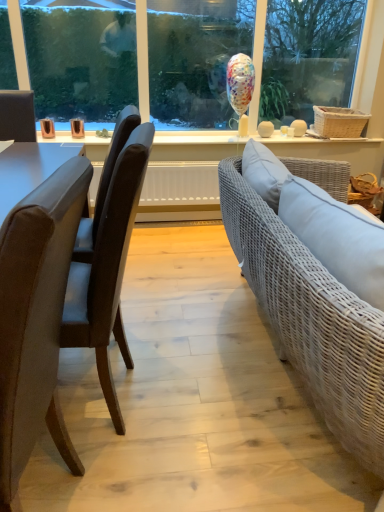
Question: Is brown leather chair at left, which is the 1th chair from front to back, further to camera compared to leather chair at left, the 1th chair from the back?

Choices:
 (A) no
 (B) yes

Answer: (A)

Question: From a real-world perspective, is brown leather chair at left, which is the 1th chair from front to back, over leather chair at left, the second chair from the front?

Choices:
 (A) yes
 (B) no

Answer: (A)

Question: Does brown leather chair at left, positioned as the 2th chair in back-to-front order, have a lesser width compared to leather chair at left, the 1th chair from the back?

Choices:
 (A) yes
 (B) no

Answer: (A)

Question: From the image's perspective, is brown leather chair at left, positioned as the 2th chair in back-to-front order, located beneath leather chair at left, the 1th chair from the back?

Choices:
 (A) yes
 (B) no

Answer: (A)

Question: Does brown leather chair at left, positioned as the 2th chair in back-to-front order, have a greater width compared to leather chair at left, the 1th chair from the back?

Choices:
 (A) no
 (B) yes

Answer: (A)

Question: Does brown leather chair at left, positioned as the 2th chair in back-to-front order, contain leather chair at left, the 1th chair from the back?

Choices:
 (A) no
 (B) yes

Answer: (A)

Question: Is leather chair at left, the 1th chair from the back, closer to the viewer compared to brown leather chair at left, positioned as the 2th chair in back-to-front order?

Choices:
 (A) no
 (B) yes

Answer: (A)

Question: From a real-world perspective, is leather chair at left, the 1th chair from the back, physically above brown leather chair at left, positioned as the 2th chair in back-to-front order?

Choices:
 (A) yes
 (B) no

Answer: (B)

Question: From the image's perspective, is leather chair at left, the second chair from the front, on brown leather chair at left, positioned as the 2th chair in back-to-front order?

Choices:
 (A) no
 (B) yes

Answer: (B)

Question: Considering the relative sizes of leather chair at left, the second chair from the front, and brown leather chair at left, which is the 1th chair from front to back, in the image provided, is leather chair at left, the second chair from the front, bigger than brown leather chair at left, which is the 1th chair from front to back,?

Choices:
 (A) no
 (B) yes

Answer: (B)

Question: Does leather chair at left, the 1th chair from the back, contain brown leather chair at left, which is the 1th chair from front to back?

Choices:
 (A) yes
 (B) no

Answer: (B)

Question: Is leather chair at left, the 1th chair from the back, to the right of brown leather chair at left, positioned as the 2th chair in back-to-front order, from the viewer's perspective?

Choices:
 (A) yes
 (B) no

Answer: (B)

Question: From a real-world perspective, relative to brown leather chair at left, positioned as the 2th chair in back-to-front order, is leather chair at left, the 1th chair from the back, vertically above or below?

Choices:
 (A) below
 (B) above

Answer: (A)